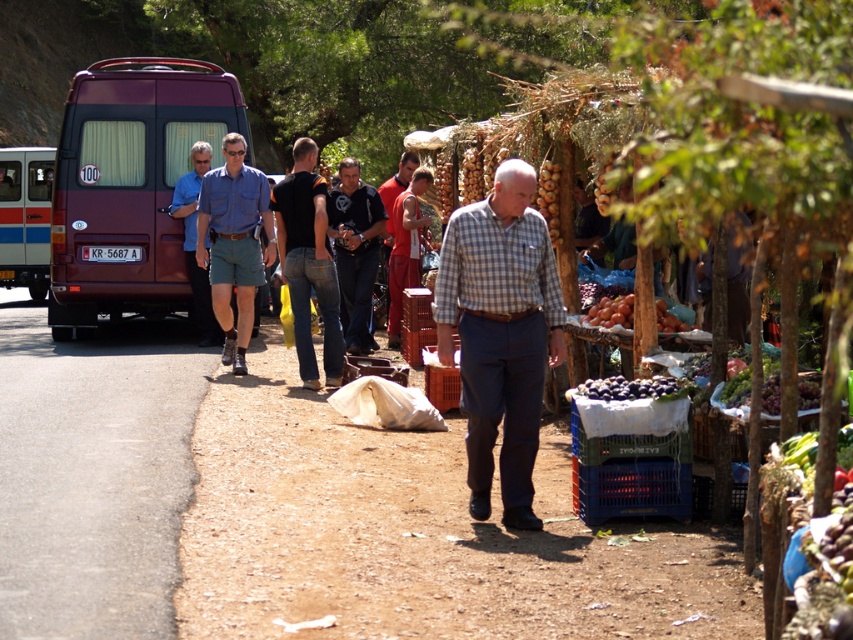
You are standing at the origin point of the image coordinate system. You want to walk to the black denim jeans at center. In which direction should you move?

Since the black denim jeans at center is located at point 0.411 on the x axis and 0.362 on the y axis, you should move towards the right and forward to reach it.

You are a photographer standing at the edge of the market. You want to take a photo that includes both the matte blue shirt at center and the shiny purple plums at center. Which object should you adjust your camera angle to focus on first if you want to ensure both fit in the frame?

Since the matte blue shirt at center is wider than the shiny purple plums at center, you should focus on the matte blue shirt at center first to ensure both fit in the frame.